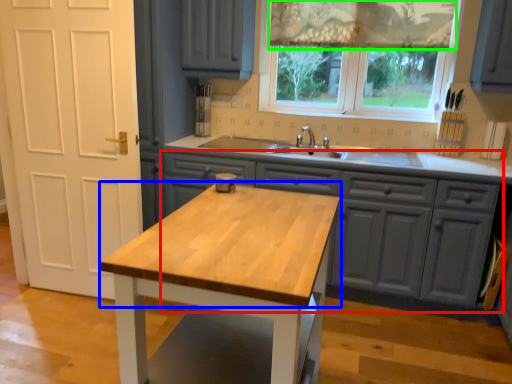
Question: Which object is the closest to the cabinetry (highlighted by a red box)? Choose among these: countertop (highlighted by a blue box) or curtain (highlighted by a green box).

Choices:
 (A) countertop
 (B) curtain

Answer: (A)